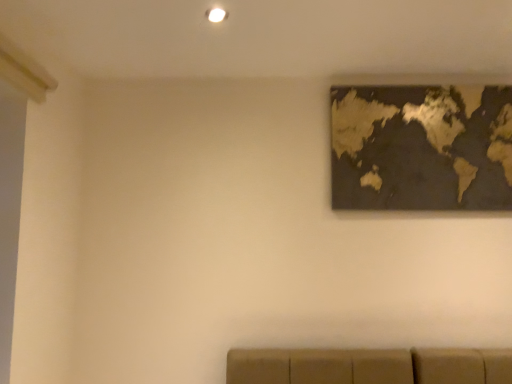
Measure the distance between point (454, 144) and camera.

Point (454, 144) and camera are 1.99 meters apart.

This screenshot has width=512, height=384. What do you see at coordinates (422, 147) in the screenshot? I see `gold metallic map at upper right` at bounding box center [422, 147].

Find the location of a particular element. The width and height of the screenshot is (512, 384). gold metallic map at upper right is located at coordinates (422, 147).

This screenshot has height=384, width=512. I want to click on gold metallic map at upper right, so click(x=422, y=147).